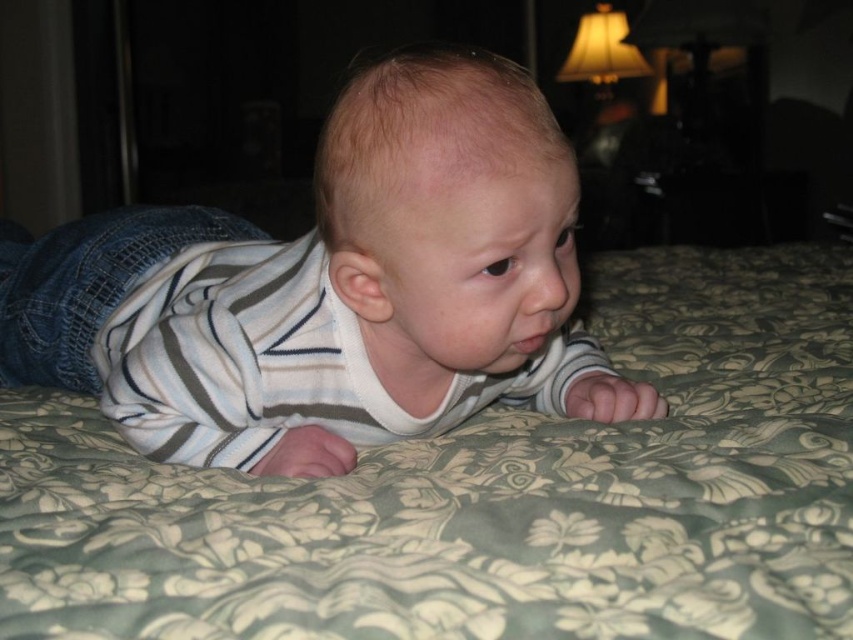
You are a photographer trying to capture a closeup of the baby while ensuring the floral fabric bedcover at center remains in the frame. Given that your camera has a depth of field that can focus on objects within 12 inches of the focal point, will the bedcover stay in focus if you focus on the baby?

The distance between the floral fabric bedcover at center and the camera is 13.07 inches. Since the depth of field focuses on objects within 12 inches of the focal point, the bedcover is slightly beyond this range. Therefore, focusing on the baby might cause the bedcover to be slightly out of focus.

You are a photographer setting up a shoot in the room. You need to position a light source to the left of the white striped shirt at center so that it illuminates the floral fabric bedcover at center. Is this possible given their positions?

The floral fabric bedcover at center is to the right of the white striped shirt at center, so placing the light source to the left of the white striped shirt at center would naturally direct light towards the floral fabric bedcover at center. This setup is possible.